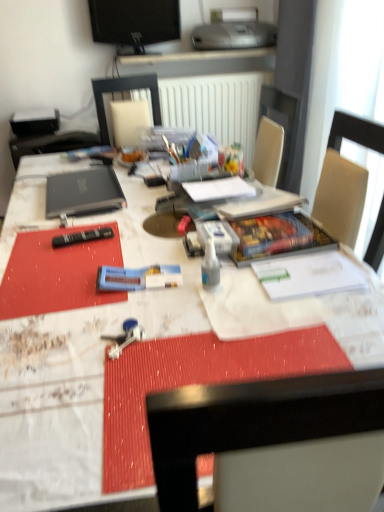
Where is `blank space situated above white glossy desk at center (from a real-world perspective)`? blank space situated above white glossy desk at center (from a real-world perspective) is located at coordinates (158, 246).